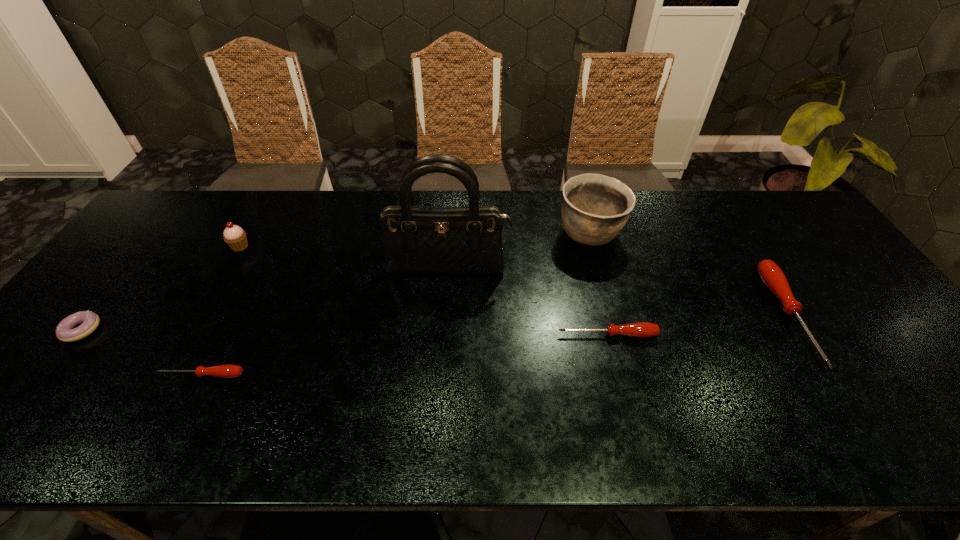
Locate an element on the screen. This screenshot has width=960, height=540. unoccupied position between the doughnut and the leftmost screwdriver is located at coordinates (141, 352).

I want to click on vacant point located between the tallest object and the third shortest object, so click(528, 302).

Find the location of a particular element. object that stands as the third closest to the pottery is located at coordinates (772, 276).

Locate which object ranks second in proximity to the fifth tallest object. Please provide its 2D coordinates. Your answer should be formatted as a tuple, i.e. [(x, y)], where the tuple contains the x and y coordinates of a point satisfying the conditions above.

[(595, 208)]

Select which screwdriver appears as the closest to the doughnut. Please provide its 2D coordinates. Your answer should be formatted as a tuple, i.e. [(x, y)], where the tuple contains the x and y coordinates of a point satisfying the conditions above.

[(224, 371)]

Point out which screwdriver is positioned as the second nearest to the shortest screwdriver. Please provide its 2D coordinates. Your answer should be formatted as a tuple, i.e. [(x, y)], where the tuple contains the x and y coordinates of a point satisfying the conditions above.

[(772, 276)]

The width and height of the screenshot is (960, 540). What are the coordinates of `vacant area in the image that satisfies the following two spatial constraints: 1. on the back side of the cupcake; 2. on the right side of the sixth shortest object` in the screenshot? It's located at tap(247, 234).

At what (x,y) coordinates should I click in order to perform the action: click on vacant space that satisfies the following two spatial constraints: 1. with an open clasp on the front of the second screwdriver from left to right; 2. on the left side of the fourth object from left to right. Please return your answer as a coordinate pair (x, y). The width and height of the screenshot is (960, 540). Looking at the image, I should click on (444, 335).